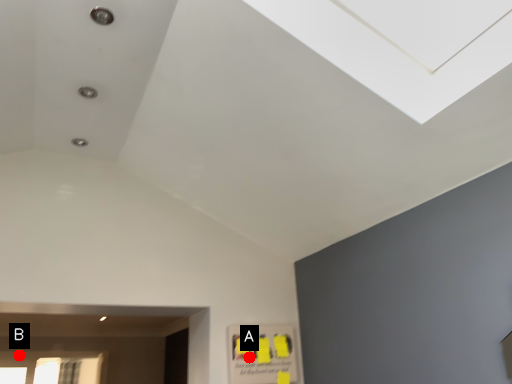
Question: Two points are circled on the image, labeled by A and B beside each circle. Which of the following is the closest to the observer?

Choices:
 (A) A is closer
 (B) B is closer

Answer: (A)